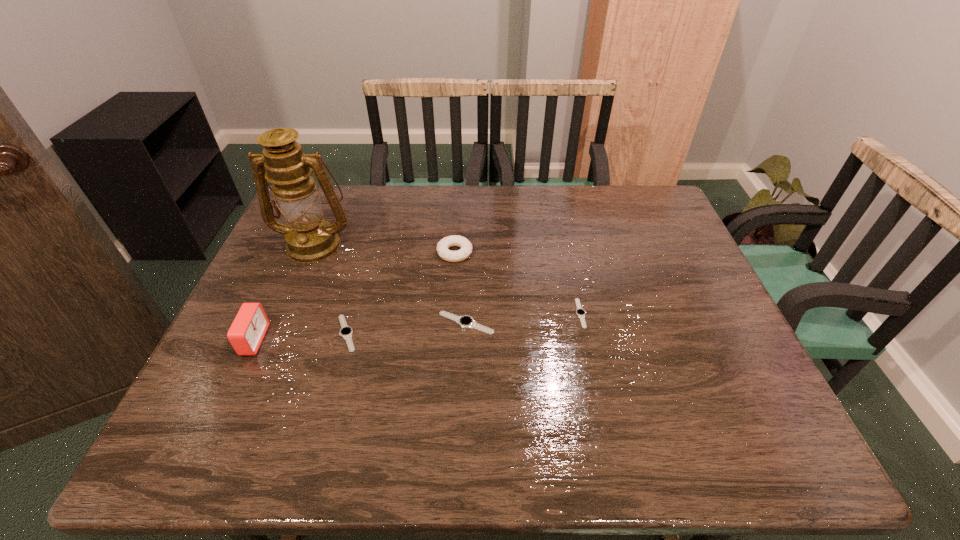
Considering the uniform spacing of watchs, where should an additional watch be positioned on the right? Please locate a free spot. Please provide its 2D coordinates. Your answer should be formatted as a tuple, i.e. [(x, y)], where the tuple contains the x and y coordinates of a point satisfying the conditions above.

[(691, 304)]